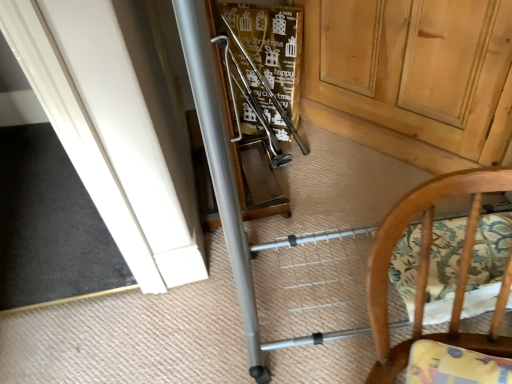
Question: Should I look upward or downward to see wooden door at center?

Choices:
 (A) up
 (B) down

Answer: (A)

Question: From a real-world perspective, does wooden door at center sit lower than wooden chair at lower right?

Choices:
 (A) no
 (B) yes

Answer: (B)

Question: Can you confirm if wooden door at center is taller than wooden chair at lower right?

Choices:
 (A) no
 (B) yes

Answer: (B)

Question: Considering the relative sizes of wooden door at center and wooden chair at lower right in the image provided, is wooden door at center thinner than wooden chair at lower right?

Choices:
 (A) yes
 (B) no

Answer: (B)

Question: Is wooden door at center shorter than wooden chair at lower right?

Choices:
 (A) no
 (B) yes

Answer: (A)

Question: Considering the relative sizes of wooden door at center and wooden chair at lower right in the image provided, is wooden door at center smaller than wooden chair at lower right?

Choices:
 (A) no
 (B) yes

Answer: (A)

Question: Can you confirm if wooden door at center is bigger than wooden chair at lower right?

Choices:
 (A) no
 (B) yes

Answer: (B)

Question: Considering the relative positions of wooden chair at lower right and wooden door at center in the image provided, is wooden chair at lower right to the right of wooden door at center from the viewer's perspective?

Choices:
 (A) yes
 (B) no

Answer: (B)

Question: Does wooden chair at lower right come behind wooden door at center?

Choices:
 (A) yes
 (B) no

Answer: (B)

Question: Can we say wooden chair at lower right lies outside wooden door at center?

Choices:
 (A) yes
 (B) no

Answer: (A)

Question: Considering the relative sizes of wooden chair at lower right and wooden door at center in the image provided, is wooden chair at lower right wider than wooden door at center?

Choices:
 (A) yes
 (B) no

Answer: (B)

Question: Is wooden chair at lower right shorter than wooden door at center?

Choices:
 (A) no
 (B) yes

Answer: (B)

Question: Considering the relative positions of wooden chair at lower right and wooden door at center in the image provided, is wooden chair at lower right to the left of wooden door at center from the viewer's perspective?

Choices:
 (A) yes
 (B) no

Answer: (A)

Question: Is point (385, 258) positioned closer to the camera than point (365, 94)?

Choices:
 (A) closer
 (B) farther

Answer: (A)